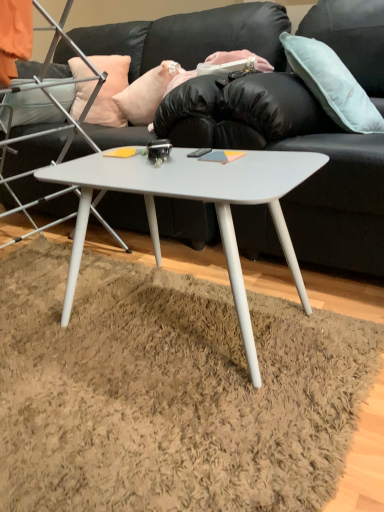
Question: Which is correct: white matte coffee table at center is inside peach fabric pillow at upper left, the 1th pillow in the left-to-right sequence, or outside of it?

Choices:
 (A) inside
 (B) outside

Answer: (B)

Question: In the image, is white matte coffee table at center positioned in front of or behind peach fabric pillow at upper left, arranged as the third pillow when viewed from the right?

Choices:
 (A) front
 (B) behind

Answer: (A)

Question: Which object is the farthest from the black leather couch at center?

Choices:
 (A) peach fabric pillow at upper left, the 1th pillow in the left-to-right sequence
 (B) light blue fabric pillow at upper right, which is counted as the 3th pillow, starting from the left
 (C) pink fabric pillow at upper center, the second pillow when ordered from right to left
 (D) white matte coffee table at center
 (E) white matte chair at center

Answer: (D)

Question: Estimate the real-world distances between objects in this image. Which object is farther from the black leather couch at center?

Choices:
 (A) peach fabric pillow at upper left, arranged as the third pillow when viewed from the right
 (B) white matte coffee table at center
 (C) light blue fabric pillow at upper right, which is counted as the 3th pillow, starting from the left
 (D) white matte chair at center
 (E) pink fabric pillow at upper center, the second pillow when ordered from right to left

Answer: (B)